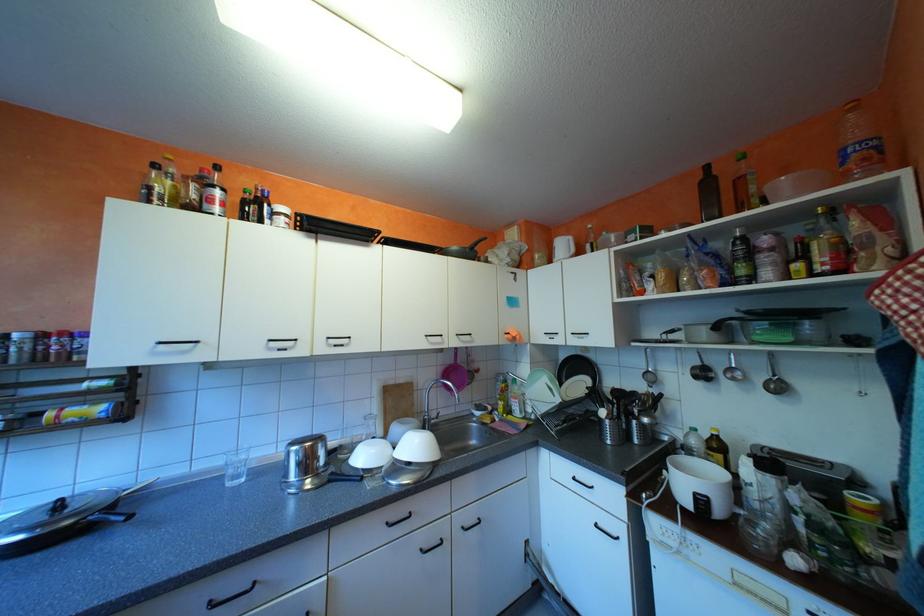
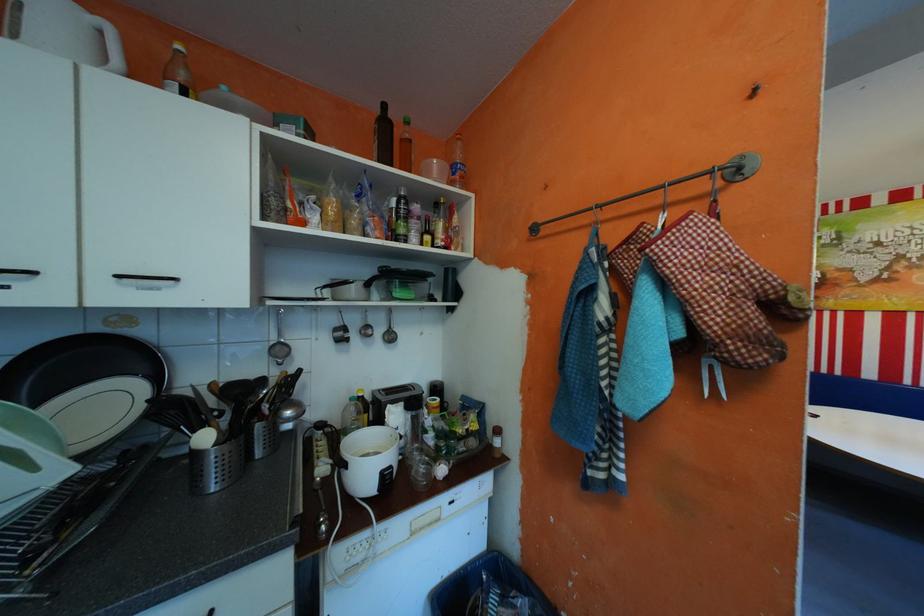
Locate, in the second image, the point that corresponds to the point at 662,374 in the first image.

(289, 346)